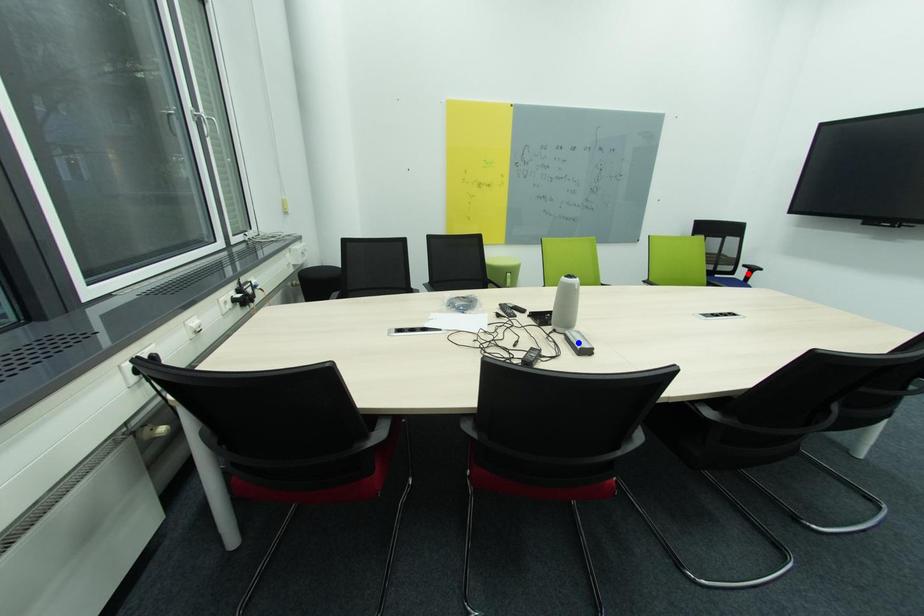
Question: Two points are marked on the image. Which point is closer to the camera?

Choices:
 (A) Blue point is closer.
 (B) Red point is closer.

Answer: (A)